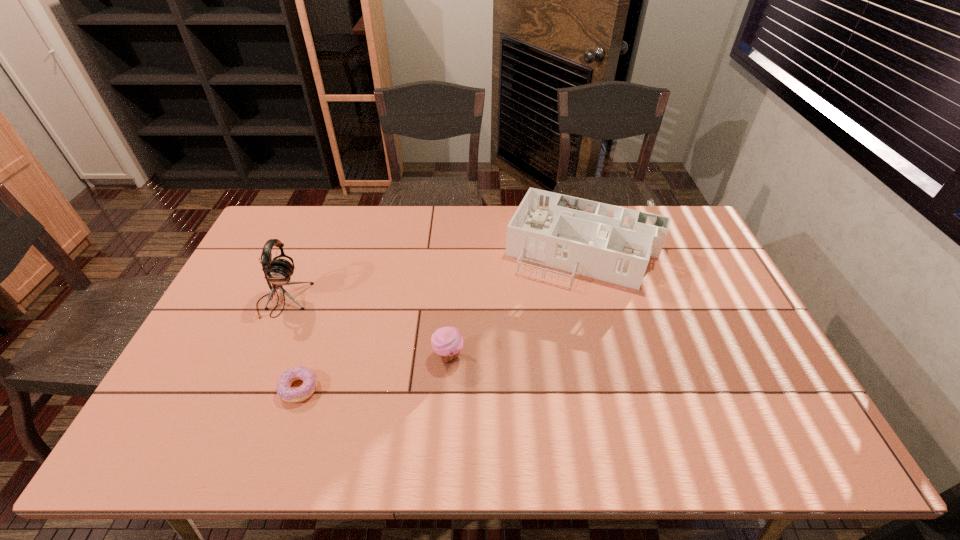
This screenshot has width=960, height=540. I want to click on vacant point located 0.220m on the right of the third farthest object, so click(x=545, y=356).

The height and width of the screenshot is (540, 960). What are the coordinates of `free spot located on the right of the nearest object` in the screenshot? It's located at (370, 388).

I want to click on object that is at the far edge, so click(x=614, y=244).

Find the location of a particular element. This screenshot has height=540, width=960. object at the left edge is located at coordinates (277, 271).

Where is `object present at the right edge`? object present at the right edge is located at coordinates (614, 244).

Identify the location of object that is at the far right corner. This screenshot has width=960, height=540. (614, 244).

Find the location of a particular element. The width and height of the screenshot is (960, 540). vacant space at the far edge of the desktop is located at coordinates (342, 244).

At what (x,y) coordinates should I click in order to perform the action: click on vacant space at the near edge of the desktop. Please return your answer as a coordinate pair (x, y). The width and height of the screenshot is (960, 540). Looking at the image, I should click on (339, 460).

Where is `free space at the left edge of the desktop`? The width and height of the screenshot is (960, 540). free space at the left edge of the desktop is located at coordinates (238, 384).

Find the location of `vacant space at the right edge of the desktop`. vacant space at the right edge of the desktop is located at coordinates (701, 312).